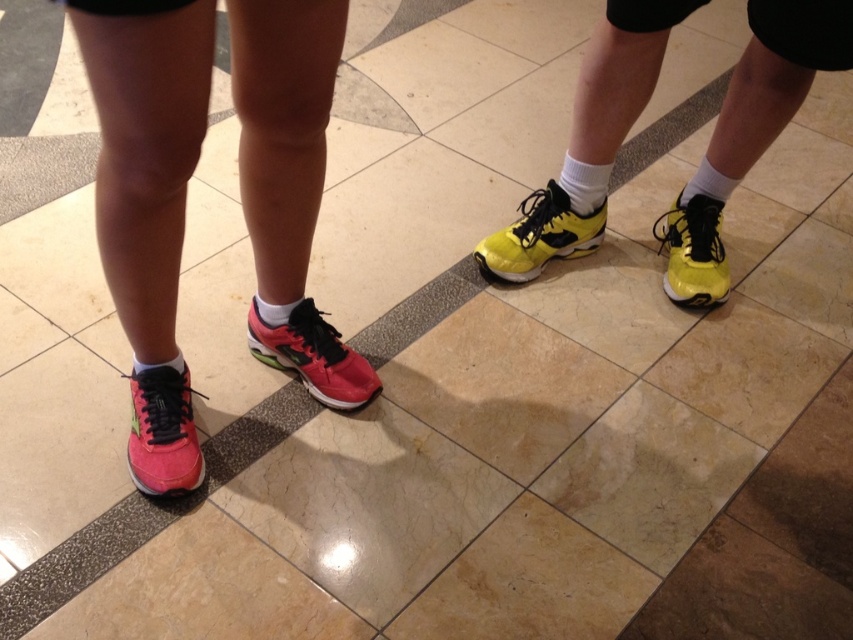
Which of these two, shiny yellow running shoe at right or pink matte running shoe at lower left, stands taller?

shiny yellow running shoe at right

Is shiny yellow running shoe at right positioned before pink matte running shoe at lower left?

No, it is behind pink matte running shoe at lower left.

Is point (805, 77) positioned behind point (170, 458)?

Yes, point (805, 77) is behind point (170, 458).

Where is `shiny yellow running shoe at right`? This screenshot has height=640, width=853. shiny yellow running shoe at right is located at coordinates (776, 74).

Can you confirm if matte pink shoe at center is positioned below pink matte running shoe at lower left?

Incorrect, matte pink shoe at center is not positioned below pink matte running shoe at lower left.

How far apart are matte pink shoe at center and pink matte running shoe at lower left?

matte pink shoe at center is 8.31 inches from pink matte running shoe at lower left.

At what (x,y) coordinates should I click in order to perform the action: click on matte pink shoe at center. Please return your answer as a coordinate pair (x, y). The width and height of the screenshot is (853, 640). Looking at the image, I should click on (144, 148).

Is matte pink shoe at center smaller than yellow matte running shoe at center?

No.

Does matte pink shoe at center have a lesser width compared to yellow matte running shoe at center?

No, matte pink shoe at center is not thinner than yellow matte running shoe at center.

Is point (312, 355) behind point (544, 248)?

That is False.

Locate an element on the screen. matte pink shoe at center is located at coordinates (144, 148).